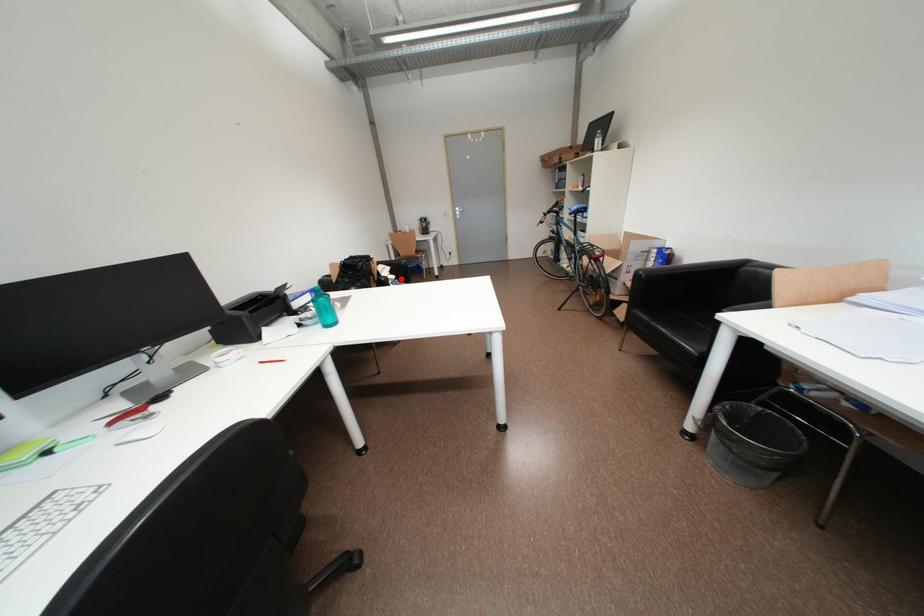
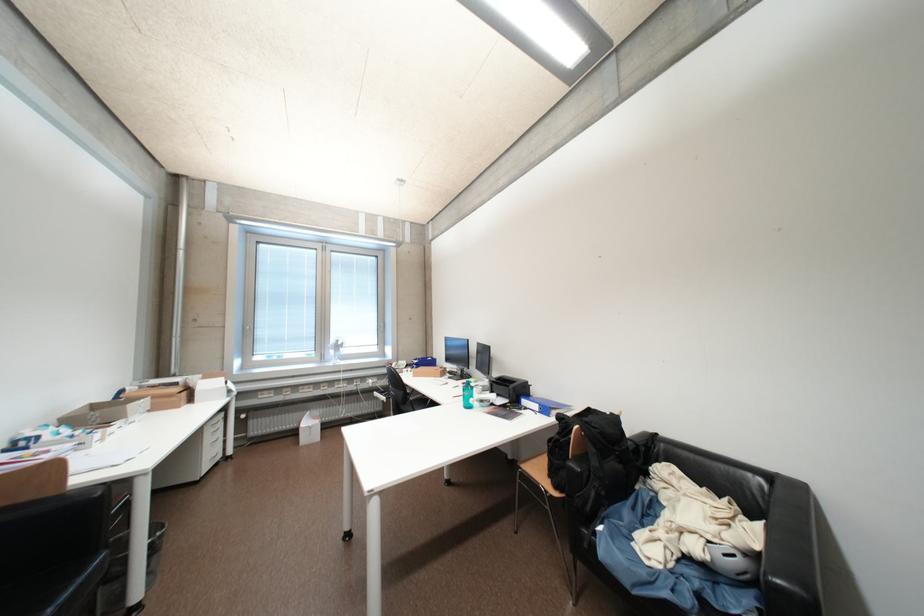
Where in the second image is the point corresponding to the highlighted location from the first image?

(704, 551)